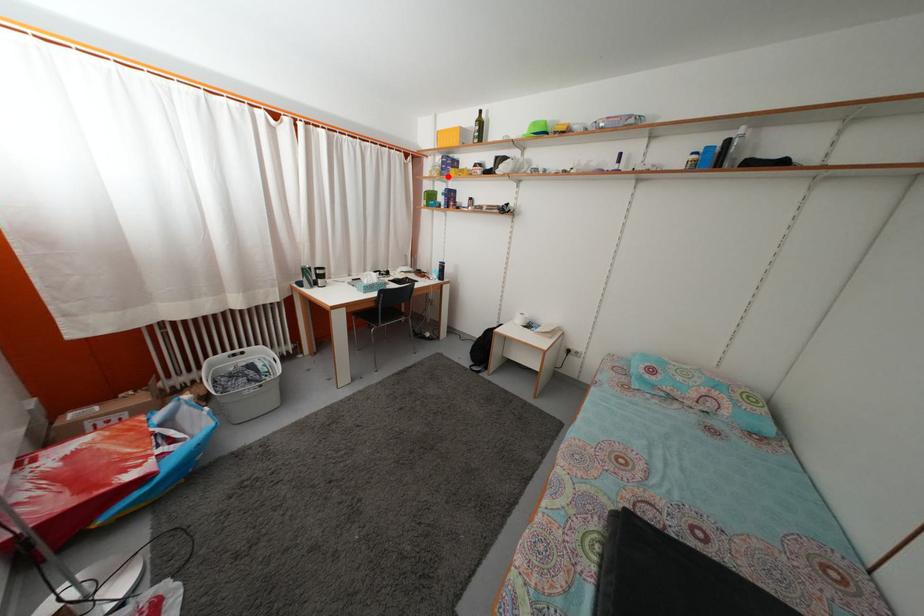
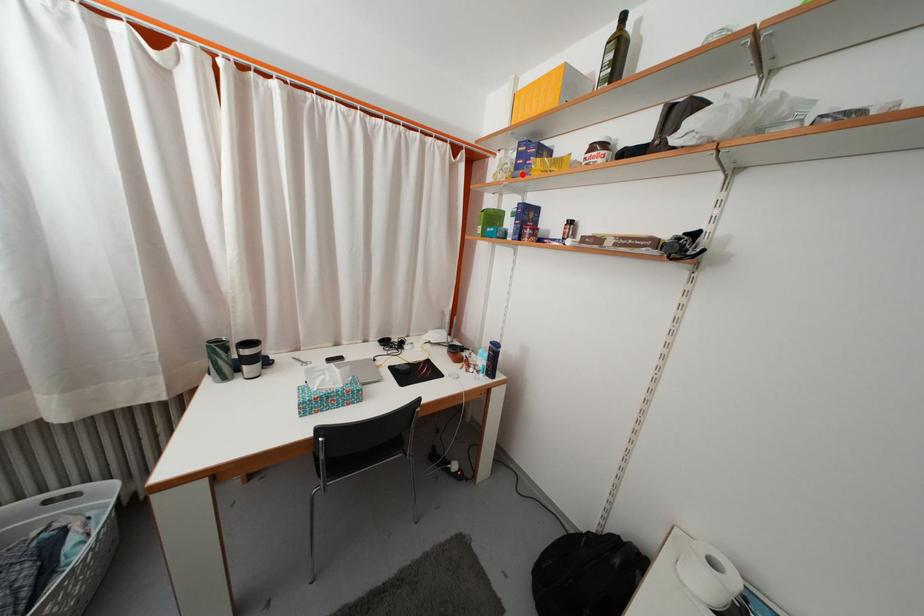
I am providing you with two images of the same scene from different viewpoints. A red point is marked on the first image and another point is marked on the second image. Are the points marked in image1 and image2 representing the same 3D position?

Yes